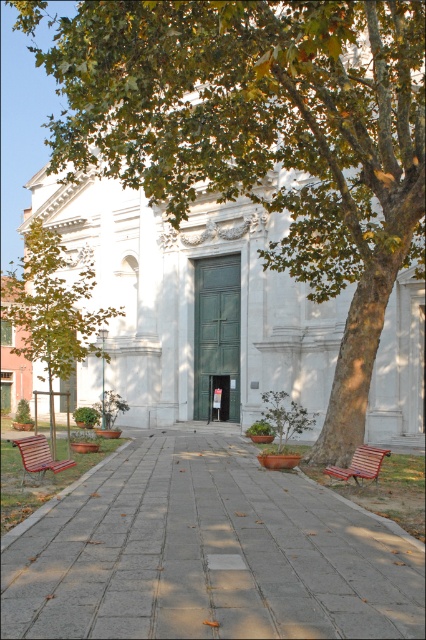
Question: Which point appears farthest from the camera in this image?

Choices:
 (A) (249, 292)
 (B) (28, 342)
 (C) (356, 480)
 (D) (37, 458)

Answer: (B)

Question: Where is paved stone walkway at center located in relation to wooden park bench at center in the image?

Choices:
 (A) below
 (B) above

Answer: (A)

Question: Is green leafy tree at center below wooden park bench at center?

Choices:
 (A) no
 (B) yes

Answer: (A)

Question: Which point is closer to the camera?

Choices:
 (A) paved stone walkway at center
 (B) white stone church at center
 (C) green leafy tree at center

Answer: (A)

Question: Does paved stone walkway at center appear on the left side of white stone church at center?

Choices:
 (A) no
 (B) yes

Answer: (A)

Question: Which object appears farthest from the camera in this image?

Choices:
 (A) green leafy tree at center
 (B) wooden park bench at lower left

Answer: (A)